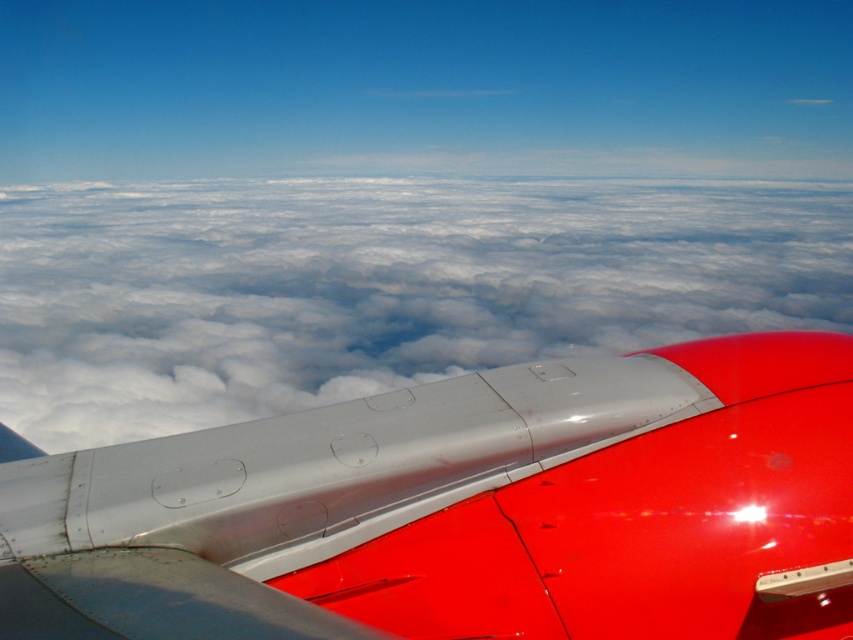
Can you confirm if metallic silver winglet at upper right is wider than cloudy white at upper center?

Incorrect, metallic silver winglet at upper right's width does not surpass cloudy white at upper center's.

Does metallic silver winglet at upper right appear under cloudy white at upper center?

Correct, metallic silver winglet at upper right is located below cloudy white at upper center.

Does point (398, 458) come farther from viewer compared to point (579, 220)?

No.

You are a GUI agent. You are given a task and a screenshot of the screen. Output one action in this format:
    pyautogui.click(x=<x>, y=<y>)
    Task: Click on the metallic silver winglet at upper right
    This screenshot has height=640, width=853.
    Given the screenshot: What is the action you would take?
    pyautogui.click(x=466, y=509)